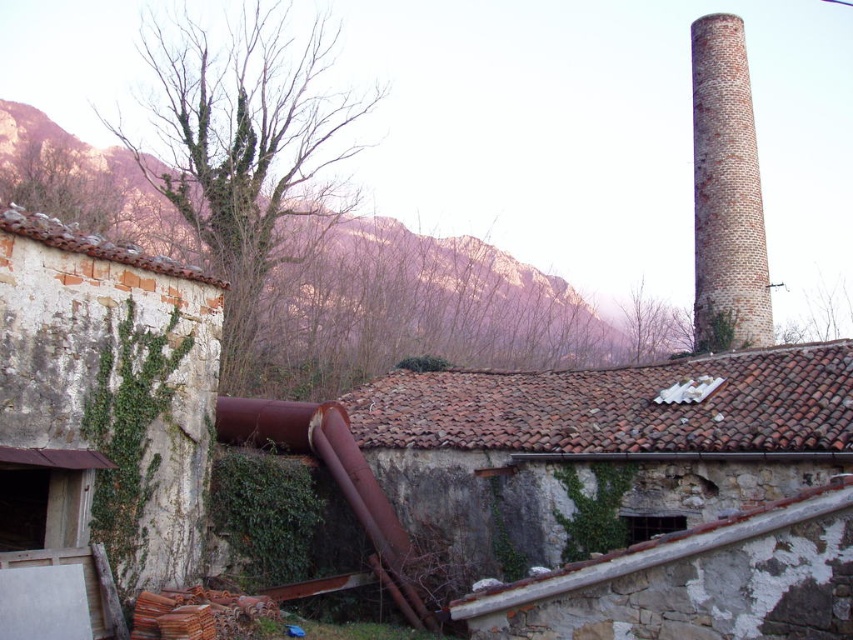
Is brick chimney at upper right wider than rusty metal pipe at lower center?

Yes, brick chimney at upper right is wider than rusty metal pipe at lower center.

Does brick chimney at upper right have a lesser width compared to rusty metal pipe at lower center?

No.

Who is more distant from viewer, (769, 305) or (262, 422)?

The point (769, 305) is more distant.

Locate an element on the screen. Image resolution: width=853 pixels, height=640 pixels. brick chimney at upper right is located at coordinates 726,188.

Is brown rocky mountain at upper left to the right of brick chimney at upper right from the viewer's perspective?

Incorrect, brown rocky mountain at upper left is not on the right side of brick chimney at upper right.

Where is `brown rocky mountain at upper left`? This screenshot has width=853, height=640. brown rocky mountain at upper left is located at coordinates coord(436,305).

Which is above, brown rocky mountain at upper left or rusty metal pipe at lower center?

brown rocky mountain at upper left is above.

Between point (425, 348) and point (368, 496), which one is positioned in front?

Positioned in front is point (368, 496).

Which is behind, point (376, 259) or point (219, 440)?

The point (376, 259) is more distant.

At what (x,y) coordinates should I click in order to perform the action: click on brown rocky mountain at upper left. Please return your answer as a coordinate pair (x, y). This screenshot has width=853, height=640. Looking at the image, I should click on (436, 305).